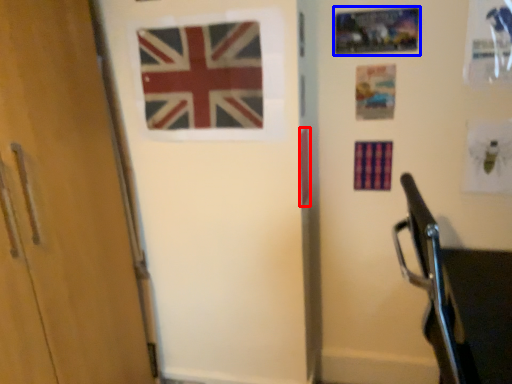
Question: Which object is closer to the camera taking this photo, flag (highlighted by a red box) or postcard (highlighted by a blue box)?

Choices:
 (A) flag
 (B) postcard

Answer: (B)